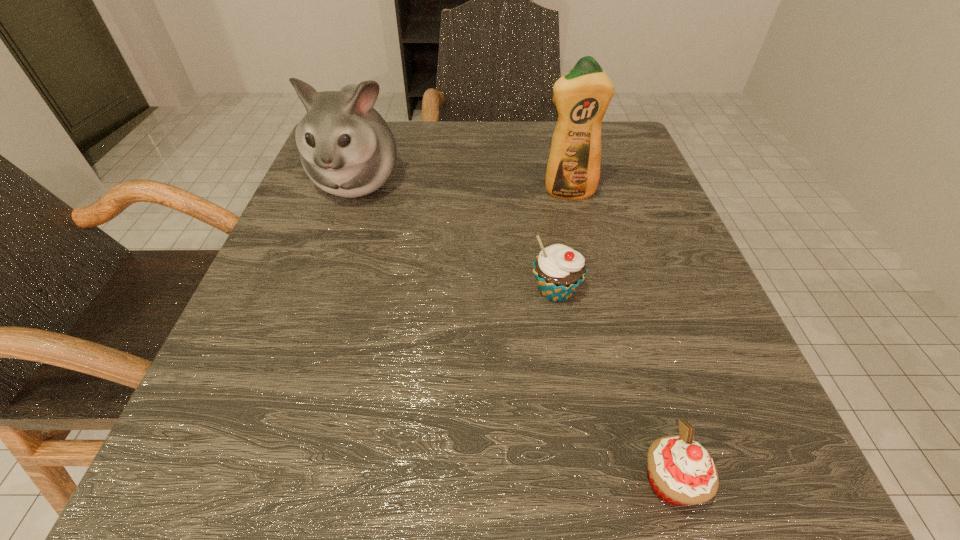
You are a GUI agent. You are given a task and a screenshot of the screen. Output one action in this format:
    pyautogui.click(x=<x>, y=<y>)
    Task: Click on the blank space at the left edge of the desktop
    
    Given the screenshot: What is the action you would take?
    pyautogui.click(x=292, y=225)

I want to click on free space at the right edge of the desktop, so click(588, 204).

In the image, there is a desktop. What are the coordinates of `blank space at the far left corner` in the screenshot? It's located at (395, 125).

In order to click on vacant space at the far right corner in this screenshot , I will do (644, 168).

Find the location of a particular element. The width and height of the screenshot is (960, 540). vacant space that's between the detergent and the second tallest object is located at coordinates (463, 187).

I want to click on vacant space in between the second tallest object and the nearest object, so click(514, 332).

This screenshot has width=960, height=540. I want to click on vacant area between the leftmost object and the tallest object, so click(x=463, y=187).

You are a GUI agent. You are given a task and a screenshot of the screen. Output one action in this format:
    pyautogui.click(x=<x>, y=<y>)
    Task: Click on the free space between the hamster and the second nearest object
    
    Given the screenshot: What is the action you would take?
    pyautogui.click(x=456, y=237)

Identify the location of free space between the leftmost object and the detergent. (463, 187).

The image size is (960, 540). Identify the location of empty location between the tallest object and the right cupcake. (619, 338).